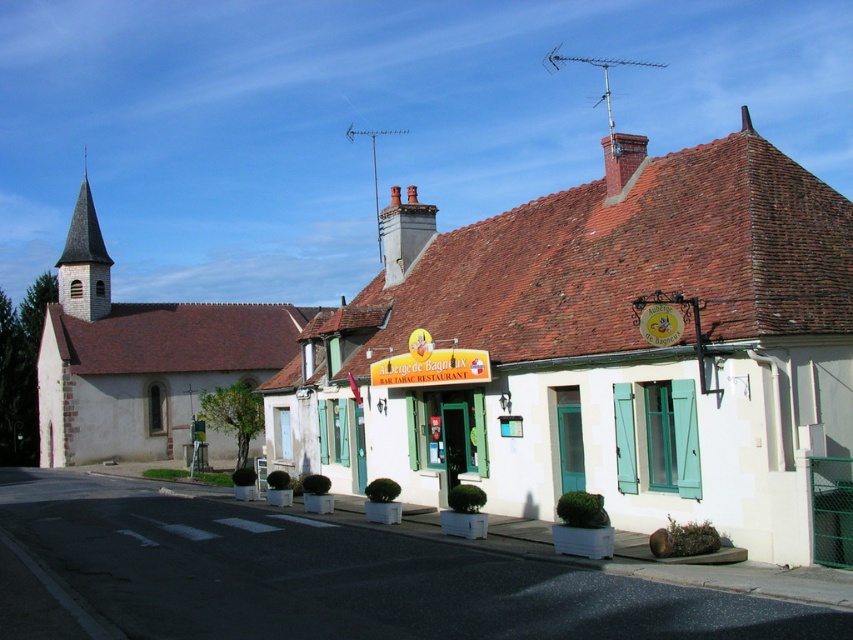
You are a tourist standing on the village street and want to take a photo of both the white painted wood church at center and the smooth gray steeple at left. Which object should you position closer to the camera to ensure both are fully visible in the frame?

The white painted wood church at center is much taller than the smooth gray steeple at left, so you should position the white painted wood church at center closer to the camera to ensure both are fully visible in the frame.

You are a tourist standing in the village square and want to take a photo of both the white painted wood church at center and the stone church at left. Which church should you position yourself closer to in order to capture both in the frame without cropping?

You should position yourself closer to the stone church at left because the white painted wood church at center is taller, so being closer to the shorter stone church at left will help balance their sizes in the photo frame.